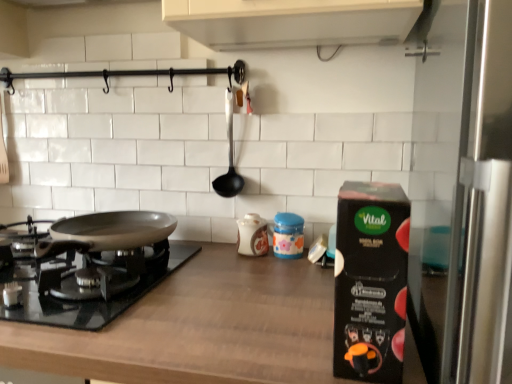
Locate an element on the screen. vacant space in front of matte ceramic jar at center, which is the second kitchen appliance in front-to-back order is located at coordinates (283, 274).